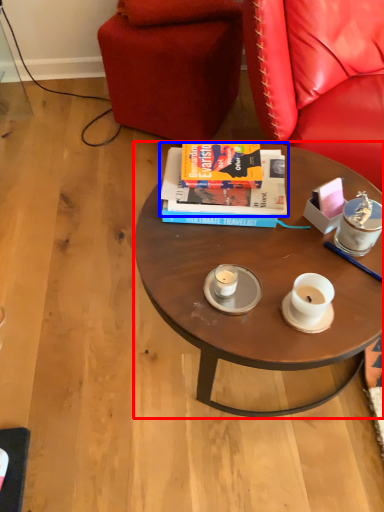
Question: Which object is closer to the camera taking this photo, coffee table (highlighted by a red box) or book (highlighted by a blue box)?

Choices:
 (A) coffee table
 (B) book

Answer: (A)